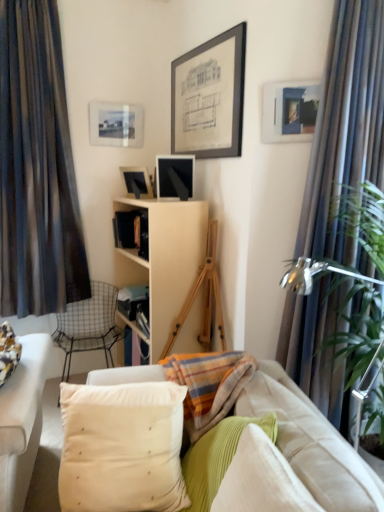
This screenshot has width=384, height=512. Identify the location of matte black picture frame at upper center, which is counted as the second picture frame, starting from the left. (136, 182).

Measure the distance between matte blue picture frame at upper right, the first picture frame viewed from the front, and camera.

2.15 meters.

Measure the distance between point (143, 418) and camera.

The distance of point (143, 418) from camera is 5.47 feet.

What do you see at coordinates (122, 447) in the screenshot?
I see `white soft pillow at center, which is counted as the 3th pillow, starting from the right` at bounding box center [122, 447].

What is the approximate width of metallic wire chair at left?

metallic wire chair at left is 23.72 inches in width.

Image resolution: width=384 pixels, height=512 pixels. What are the coordinates of `matte glass picture frame at upper center, which is the 1th picture frame from left to right` in the screenshot? It's located at (115, 124).

Between green corduroy pillow at center, which is the 2th pillow from right to left, and corduroy fabric pillow at lower right, the first pillow from the right, which one has smaller width?

green corduroy pillow at center, which is the 2th pillow from right to left.

From a real-world perspective, is green corduroy pillow at center, which is the 2th pillow from right to left, physically above corduroy fabric pillow at lower right, which is the third pillow in left-to-right order?

No.

Which is closer, (239, 437) or (256, 460)?

Positioned in front is point (256, 460).

Can you confirm if green corduroy pillow at center, the 2th pillow when ordered from left to right, is bigger than corduroy fabric pillow at lower right, the first pillow from the right?

Yes.

The image size is (384, 512). I want to click on pillow that is the 1st object located below the matte blue picture frame at upper right, which is the third picture frame in left-to-right order (from the image's perspective), so click(122, 447).

How many degrees apart are the facing directions of white soft pillow at center, which ranks as the first pillow in left-to-right order, and matte blue picture frame at upper right, the first picture frame viewed from the front?

The angular difference between white soft pillow at center, which ranks as the first pillow in left-to-right order, and matte blue picture frame at upper right, the first picture frame viewed from the front, is 27.7 degrees.

Is white soft pillow at center, which is counted as the 3th pillow, starting from the right, facing away from matte blue picture frame at upper right, which is the third picture frame in left-to-right order?

No, white soft pillow at center, which is counted as the 3th pillow, starting from the right, is not facing away from matte blue picture frame at upper right, which is the third picture frame in left-to-right order.

From the image's perspective, relative to matte blue picture frame at upper right, positioned as the first picture frame in right-to-left order, is white soft pillow at center, which is counted as the 3th pillow, starting from the right, above or below?

white soft pillow at center, which is counted as the 3th pillow, starting from the right, is below matte blue picture frame at upper right, positioned as the first picture frame in right-to-left order.

Considering their positions, is matte black picture frame at upper center, which is the 2th picture frame from back to front, located in front of or behind corduroy fabric pillow at lower right, which is the third pillow in left-to-right order?

Clearly, matte black picture frame at upper center, which is the 2th picture frame from back to front, is behind corduroy fabric pillow at lower right, which is the third pillow in left-to-right order.

Is matte black picture frame at upper center, placed as the 2th picture frame when sorted from front to back, positioned with its back to corduroy fabric pillow at lower right, the first pillow from the right?

matte black picture frame at upper center, placed as the 2th picture frame when sorted from front to back, is not turned away from corduroy fabric pillow at lower right, the first pillow from the right.

From a real-world perspective, is matte black picture frame at upper center, the second picture frame when ordered from right to left, positioned under corduroy fabric pillow at lower right, which is the third pillow in left-to-right order, based on gravity?

No.

Is wooden easel at center inside matte glass picture frame at upper center, arranged as the first picture frame when viewed from the top?

No, wooden easel at center is not inside matte glass picture frame at upper center, arranged as the first picture frame when viewed from the top.

Considering the sizes of objects matte glass picture frame at upper center, which is the 1th picture frame from left to right, and wooden easel at center in the image provided, who is smaller, matte glass picture frame at upper center, which is the 1th picture frame from left to right, or wooden easel at center?

With smaller size is matte glass picture frame at upper center, which is the 1th picture frame from left to right.

Considering the positions of point (92, 117) and point (190, 305), is point (92, 117) closer or farther from the camera than point (190, 305)?

Point (92, 117) is farther from the camera than point (190, 305).

How much distance is there between matte glass picture frame at upper center, marked as the 3th picture frame in a bottom-to-top arrangement, and wooden easel at center?

The distance of matte glass picture frame at upper center, marked as the 3th picture frame in a bottom-to-top arrangement, from wooden easel at center is 1.24 meters.

Relative to matte black picture frame at upper center, acting as the third picture frame starting from the top, is green leafy plant at right in front or behind?

Visually, green leafy plant at right is located in front of matte black picture frame at upper center, acting as the third picture frame starting from the top.

From a real-world perspective, which object stands above the other?

In real-world perspective, matte black picture frame at upper center, the second picture frame when ordered from right to left, is above.

How different are the orientations of green leafy plant at right and matte black picture frame at upper center, which is counted as the first picture frame, starting from the bottom, in degrees?

The angle between the facing direction of green leafy plant at right and the facing direction of matte black picture frame at upper center, which is counted as the first picture frame, starting from the bottom, is 149 degrees.

Which is in front, point (343, 202) or point (140, 185)?

The point (343, 202) is closer to the camera.

This screenshot has width=384, height=512. There is a wooden easel at center. What are the coordinates of `the 2nd curtain above it (from the image's perspective)` in the screenshot? It's located at (37, 168).

Is wooden easel at center further to the viewer compared to dark striped fabric curtain at left, which appears as the 2th curtain when viewed from the front?

No, it is not.

Is wooden easel at center taller or shorter than dark striped fabric curtain at left, which appears as the 2th curtain when viewed from the front?

→ wooden easel at center is shorter than dark striped fabric curtain at left, which appears as the 2th curtain when viewed from the front.

Is wooden easel at center bigger than dark striped fabric curtain at left, the first curtain positioned from the back?

Incorrect, wooden easel at center is not larger than dark striped fabric curtain at left, the first curtain positioned from the back.

Is corduroy fabric pillow at lower right, the first pillow from the right, aimed at white soft pillow at center, which ranks as the first pillow in left-to-right order?

No.

Considering the sizes of objects corduroy fabric pillow at lower right, the first pillow from the right, and white soft pillow at center, which is counted as the 3th pillow, starting from the right, in the image provided, who is thinner, corduroy fabric pillow at lower right, the first pillow from the right, or white soft pillow at center, which is counted as the 3th pillow, starting from the right,?

Thinner between the two is corduroy fabric pillow at lower right, the first pillow from the right.

Is corduroy fabric pillow at lower right, which is the third pillow in left-to-right order, directly adjacent to white soft pillow at center, which is counted as the 3th pillow, starting from the right?

corduroy fabric pillow at lower right, which is the third pillow in left-to-right order, and white soft pillow at center, which is counted as the 3th pillow, starting from the right, are clearly separated.

Which is more to the right, corduroy fabric pillow at lower right, which is the third pillow in left-to-right order, or white soft pillow at center, which ranks as the first pillow in left-to-right order?

From the viewer's perspective, corduroy fabric pillow at lower right, which is the third pillow in left-to-right order, appears more on the right side.

Identify the location of pillow lying in front of the green corduroy pillow at center, the 2th pillow when ordered from left to right. (261, 479).

From a real-world perspective, count 2nd pillows downward from the matte blue picture frame at upper right, which ranks as the third picture frame in back-to-front order, and point to it. Please provide its 2D coordinates.

[(122, 447)]

Based on the photo, when comparing their distances from metallic wire chair at left, does dark striped fabric curtain at left, which appears as the 2th curtain when viewed from the front, or green leafy plant at right seem further?

green leafy plant at right lies further to metallic wire chair at left than the other object.

Looking at the image, which one is located closer to green corduroy pillow at center, which is the 2th pillow from right to left, black matte bookshelf at center or silky blue curtain at right, acting as the first curtain starting from the right?

Among the two, silky blue curtain at right, acting as the first curtain starting from the right, is located nearer to green corduroy pillow at center, which is the 2th pillow from right to left.

Estimate the real-world distances between objects in this image. Which object is closer to soft beige fabric couch at center, matte blue picture frame at upper right, the 2th picture frame when ordered from bottom to top, or green corduroy pillow at center, the 2th pillow when ordered from left to right?

green corduroy pillow at center, the 2th pillow when ordered from left to right, is positioned closer to the anchor soft beige fabric couch at center.

From the picture: Based on their spatial positions, is green leafy plant at right or green corduroy pillow at center, which is the 2th pillow from right to left, further from matte blue picture frame at upper right, the 2th picture frame when ordered from top to bottom?

The object further to matte blue picture frame at upper right, the 2th picture frame when ordered from top to bottom, is green corduroy pillow at center, which is the 2th pillow from right to left.

Based on their spatial positions, is matte glass picture frame at upper center, which ranks as the third picture frame in front-to-back order, or dark striped fabric curtain at left, which appears as the 2th curtain when viewed from the front, closer to white soft pillow at center, which ranks as the first pillow in left-to-right order?

dark striped fabric curtain at left, which appears as the 2th curtain when viewed from the front, is positioned closer to the anchor white soft pillow at center, which ranks as the first pillow in left-to-right order.

Looking at this image, looking at the image, which one is located closer to silky blue curtain at right, which is the 2th curtain from back to front, dark striped fabric curtain at left, the first curtain positioned from the back, or corduroy fabric pillow at lower right, the first pillow from the right?

Among the two, corduroy fabric pillow at lower right, the first pillow from the right, is located nearer to silky blue curtain at right, which is the 2th curtain from back to front.

From the picture: Estimate the real-world distances between objects in this image. Which object is closer to matte glass picture frame at upper center, the first picture frame when ordered from back to front, corduroy fabric pillow at lower right, which is the third pillow in left-to-right order, or green leafy plant at right?

green leafy plant at right is positioned closer to the anchor matte glass picture frame at upper center, the first picture frame when ordered from back to front.

When comparing their distances from matte black picture frame at upper center, which is counted as the second picture frame, starting from the left, does wooden easel at center or matte glass picture frame at upper center, marked as the 3th picture frame in a bottom-to-top arrangement, seem closer?

The object closer to matte black picture frame at upper center, which is counted as the second picture frame, starting from the left, is matte glass picture frame at upper center, marked as the 3th picture frame in a bottom-to-top arrangement.

Where is `easel between corduroy fabric pillow at lower right, which is the third pillow in left-to-right order, and black matte bookshelf at center in the front-back direction`? This screenshot has height=512, width=384. easel between corduroy fabric pillow at lower right, which is the third pillow in left-to-right order, and black matte bookshelf at center in the front-back direction is located at coordinates (206, 298).

Locate an element on the screen. This screenshot has height=512, width=384. plant between soft beige fabric couch at center and black matte bookshelf at center along the z-axis is located at coordinates (358, 333).

The width and height of the screenshot is (384, 512). What are the coordinates of `curtain between white soft pillow at center, which is counted as the 3th pillow, starting from the right, and green leafy plant at right` in the screenshot? It's located at (346, 130).

Image resolution: width=384 pixels, height=512 pixels. In order to click on pillow between silky blue curtain at right, which is the second curtain from left to right, and corduroy fabric pillow at lower right, which is the third pillow in left-to-right order, in the vertical direction in this screenshot , I will do `click(122, 447)`.